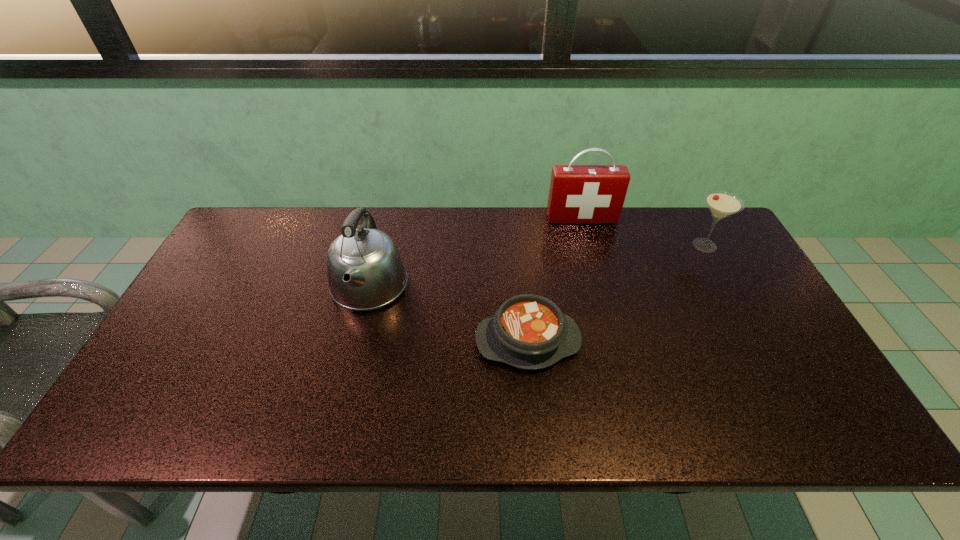
Find the location of a particular element. This screenshot has width=960, height=540. empty location between the casserole and the first-aid kit is located at coordinates (555, 280).

Where is `free spot between the rightmost object and the kettle`? This screenshot has width=960, height=540. free spot between the rightmost object and the kettle is located at coordinates (537, 266).

This screenshot has width=960, height=540. In order to click on free space between the shortest object and the second shortest object in this screenshot , I will do `click(616, 293)`.

Where is `empty space that is in between the first-aid kit and the kettle`? This screenshot has width=960, height=540. empty space that is in between the first-aid kit and the kettle is located at coordinates (475, 253).

Locate an element on the screen. Image resolution: width=960 pixels, height=540 pixels. vacant space that is in between the kettle and the casserole is located at coordinates (448, 314).

The width and height of the screenshot is (960, 540). I want to click on vacant space that's between the first-aid kit and the rightmost object, so click(643, 232).

Where is `free space between the first-aid kit and the leftmost object`? Image resolution: width=960 pixels, height=540 pixels. free space between the first-aid kit and the leftmost object is located at coordinates (475, 253).

I want to click on unoccupied area between the kettle and the martini, so click(537, 266).

Identify which object is the nearest to the third tallest object. Please provide its 2D coordinates. Your answer should be formatted as a tuple, i.e. [(x, y)], where the tuple contains the x and y coordinates of a point satisfying the conditions above.

[(579, 194)]

Locate which object is the closest to the leftmost object. Please provide its 2D coordinates. Your answer should be formatted as a tuple, i.e. [(x, y)], where the tuple contains the x and y coordinates of a point satisfying the conditions above.

[(528, 331)]